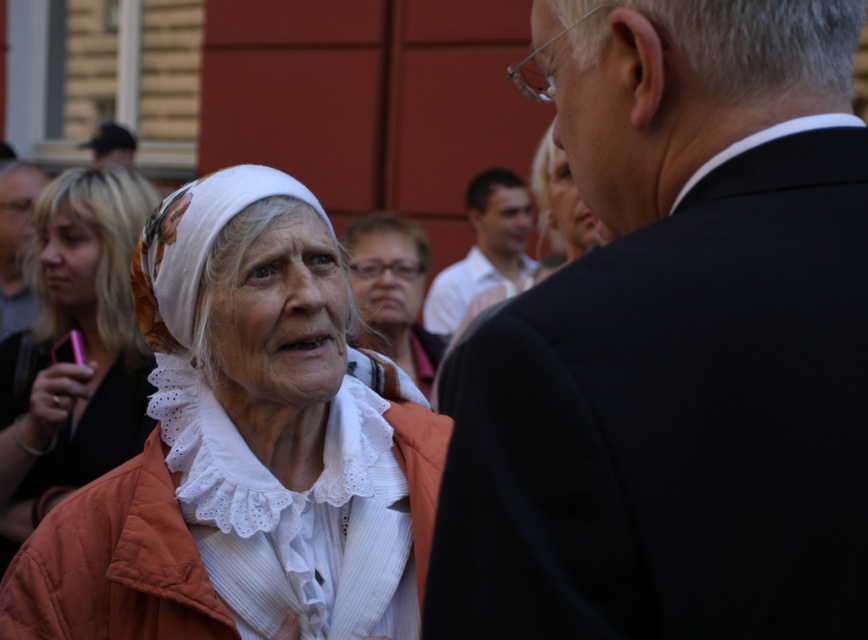
You are a photographer trying to capture a closeup of the elderly woman in the scene. You notice the matte white scarf at center and the white shirt at center. Which item should you focus on to ensure it fits entirely within your camera frame, considering their sizes?

The matte white scarf at center is shorter than the white shirt at center, so focusing on the matte white scarf at center would ensure it fits entirely within the camera frame as it is smaller in size.

You are standing at the camera position and want to take a photo of the white lace blouse at lower left. Is it within your camera range of 15 feet?

The white lace blouse at lower left is 16.69 feet from the camera, which is beyond the 15 feet range. Therefore, it cannot be captured clearly.

Please look at the image and locate the point at coordinates (82, 348). What object is exactly at that point?

The white lace blouse at lower left is exactly at point (82, 348).